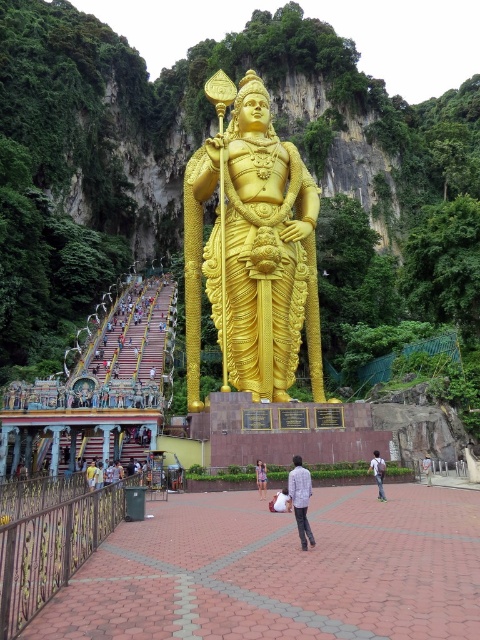
Question: Estimate the real-world distances between objects in this image. Which object is closer to the tan fabric shirt at center?

Choices:
 (A) denim shorts at center
 (B) light blue denim jeans at center

Answer: (B)

Question: Is light blue denim jeans at center to the right of denim shorts at center from the viewer's perspective?

Choices:
 (A) yes
 (B) no

Answer: (A)

Question: Is gold polished statue at center above white cotton shirt at center?

Choices:
 (A) no
 (B) yes

Answer: (B)

Question: Estimate the real-world distances between objects in this image. Which object is closer to the gold polished statue at center?

Choices:
 (A) light gray fabric shirt at center
 (B) light blue denim jeans at center
 (C) denim shorts at center

Answer: (B)

Question: Which point is farther from the camera taking this photo?

Choices:
 (A) (295, 273)
 (B) (105, 480)
 (C) (422, 468)

Answer: (A)

Question: Where is gold polished statue at center located in relation to denim shorts at center in the image?

Choices:
 (A) above
 (B) below

Answer: (A)